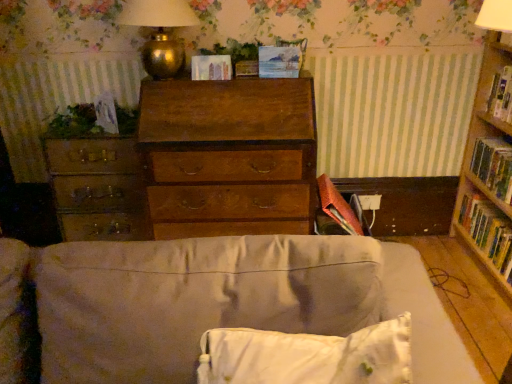
You are a GUI agent. You are given a task and a screenshot of the screen. Output one action in this format:
    pyautogui.click(x=<x>, y=<y>)
    Task: Click on the free space in front of green leafy plant at center, positioned as the 2th plant in bottom-to-top order
    
    Given the screenshot: What is the action you would take?
    pyautogui.click(x=243, y=77)